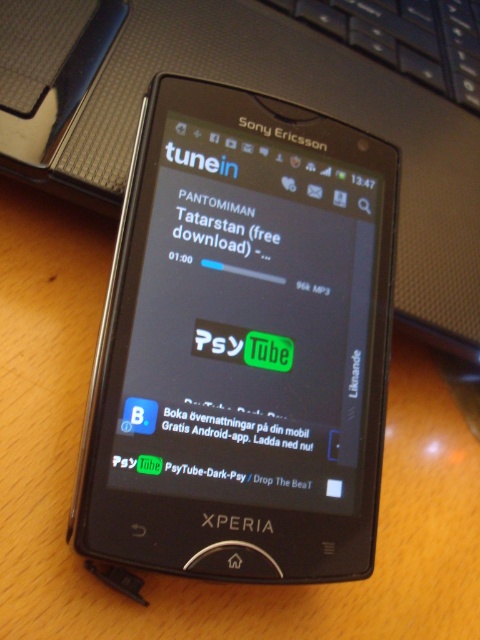
Question: Can you confirm if matte black screen at center is wider than white matte text at center?

Choices:
 (A) no
 (B) yes

Answer: (B)

Question: Which of the following is the farthest from the observer?

Choices:
 (A) matte black screen at center
 (B) white matte text at center

Answer: (B)

Question: Is matte black screen at center bigger than white matte text at center?

Choices:
 (A) yes
 (B) no

Answer: (A)

Question: Among these points, which one is nearest to the camera?

Choices:
 (A) (240, 300)
 (B) (193, 193)

Answer: (A)

Question: Considering the relative positions of matte black screen at center and white matte text at center in the image provided, where is matte black screen at center located with respect to white matte text at center?

Choices:
 (A) right
 (B) left

Answer: (A)

Question: Which object appears farthest from the camera in this image?

Choices:
 (A) white matte text at center
 (B) matte black screen at center

Answer: (A)